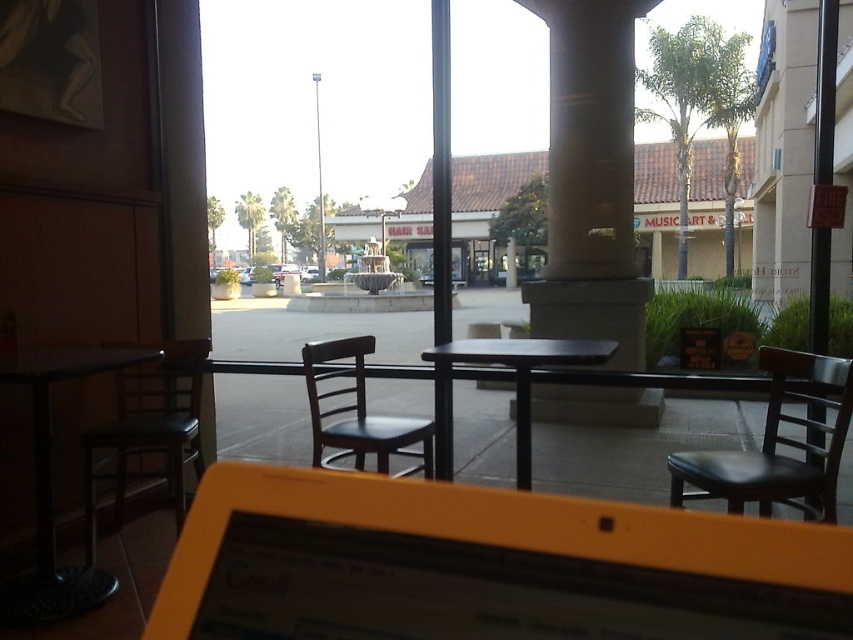
You are sitting at the black leather chair at left in the cafe. You notice a point marked at coordinates (148, 429). Based on the scene description, where is this point located relative to your current position?

The point is on the black leather chair at left where you are sitting.

You are sitting at the black matte table at center in the cafe. You want to place your coffee mug on the table without it being in the way of the white metallic pole at center. Is the table positioned in a way that allows this?

The black matte table at center is below the white metallic pole at center, so placing the coffee mug on the table would not interfere with the pole since the table is positioned directly underneath it.